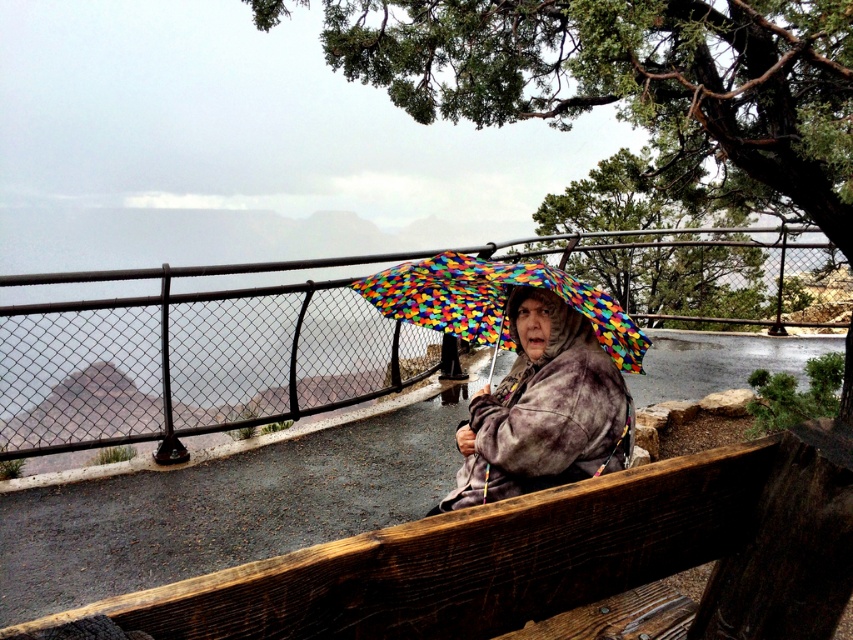
Question: Does wooden bench at center appear over multicolored fabric umbrella at center?

Choices:
 (A) no
 (B) yes

Answer: (A)

Question: Which point is farther to the camera?

Choices:
 (A) green textured tree at upper center
 (B) metallic chain-link fence at center

Answer: (A)

Question: Is green textured tree at upper center smaller than rainbow-patterned umbrella at center?

Choices:
 (A) no
 (B) yes

Answer: (A)

Question: Based on their relative distances, which object is farther from the wooden bench at center?

Choices:
 (A) rainbow-patterned umbrella at center
 (B) green textured tree at upper center
 (C) multicolored fabric umbrella at center
 (D) metallic chain-link fence at center

Answer: (D)

Question: Which of the following is the closest to the observer?

Choices:
 (A) multicolored fabric umbrella at center
 (B) green textured tree at upper center
 (C) rainbow-patterned umbrella at center
 (D) wooden bench at center

Answer: (D)

Question: Is green textured tree at upper center to the left of wooden bench at center from the viewer's perspective?

Choices:
 (A) yes
 (B) no

Answer: (B)